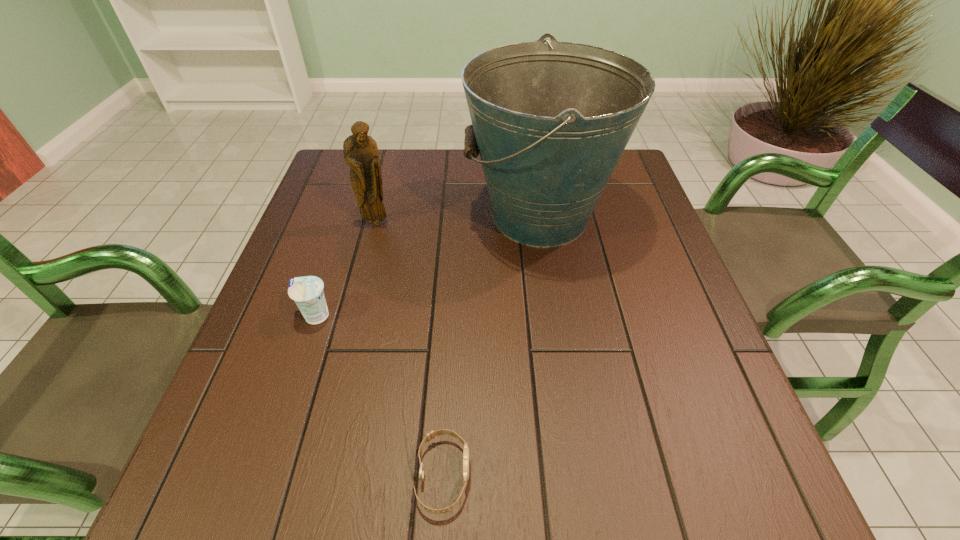
What are the coordinates of `vacant region located on the right of the yogurt` in the screenshot? It's located at (430, 316).

The width and height of the screenshot is (960, 540). Find the location of `vacant space located 0.050m on the face of the shortest object`. vacant space located 0.050m on the face of the shortest object is located at coordinates (501, 475).

Where is `object situated at the far edge`? The height and width of the screenshot is (540, 960). object situated at the far edge is located at coordinates (550, 121).

Locate an element on the screen. This screenshot has width=960, height=540. object located in the near edge section of the desktop is located at coordinates (432, 434).

Locate an element on the screen. This screenshot has width=960, height=540. figurine present at the left edge is located at coordinates (361, 153).

Identify the location of yogurt at the left edge. (307, 292).

Image resolution: width=960 pixels, height=540 pixels. Find the location of `object located at the right edge`. object located at the right edge is located at coordinates (550, 121).

The width and height of the screenshot is (960, 540). What are the coordinates of `object that is at the far right corner` in the screenshot? It's located at (550, 121).

Image resolution: width=960 pixels, height=540 pixels. I want to click on vacant space at the near edge, so click(x=634, y=490).

This screenshot has height=540, width=960. In order to click on free space at the left edge of the desktop in this screenshot , I will do pyautogui.click(x=314, y=336).